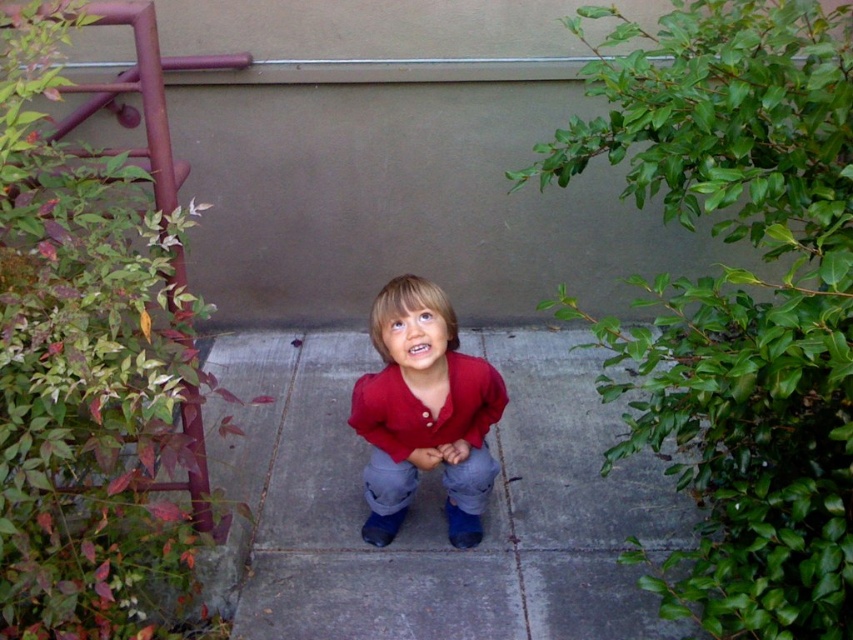
Question: Among these objects, which one is nearest to the camera?

Choices:
 (A) denim jeans at center
 (B) gray concrete pavement at center
 (C) matte red shirt at center

Answer: (C)

Question: Is gray concrete pavement at center smaller than denim jeans at center?

Choices:
 (A) no
 (B) yes

Answer: (A)

Question: Which object is closer to the camera taking this photo?

Choices:
 (A) gray concrete pavement at center
 (B) matte red shirt at center

Answer: (B)

Question: Which of the following is the farthest from the observer?

Choices:
 (A) (265, 492)
 (B) (396, 499)
 (C) (396, 280)

Answer: (A)

Question: Is gray concrete pavement at center below denim jeans at center?

Choices:
 (A) yes
 (B) no

Answer: (B)

Question: Does gray concrete pavement at center lie in front of denim jeans at center?

Choices:
 (A) no
 (B) yes

Answer: (B)